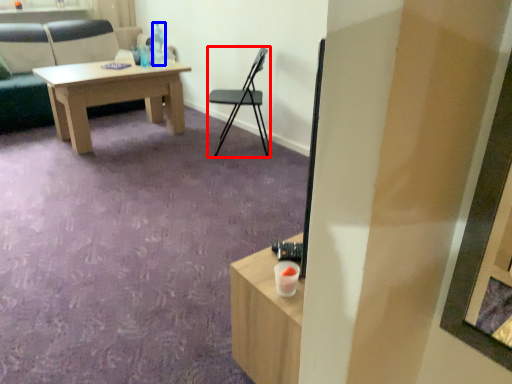
Question: Among these objects, which one is farthest to the camera, chair (highlighted by a red box) or bottle (highlighted by a blue box)?

Choices:
 (A) chair
 (B) bottle

Answer: (B)